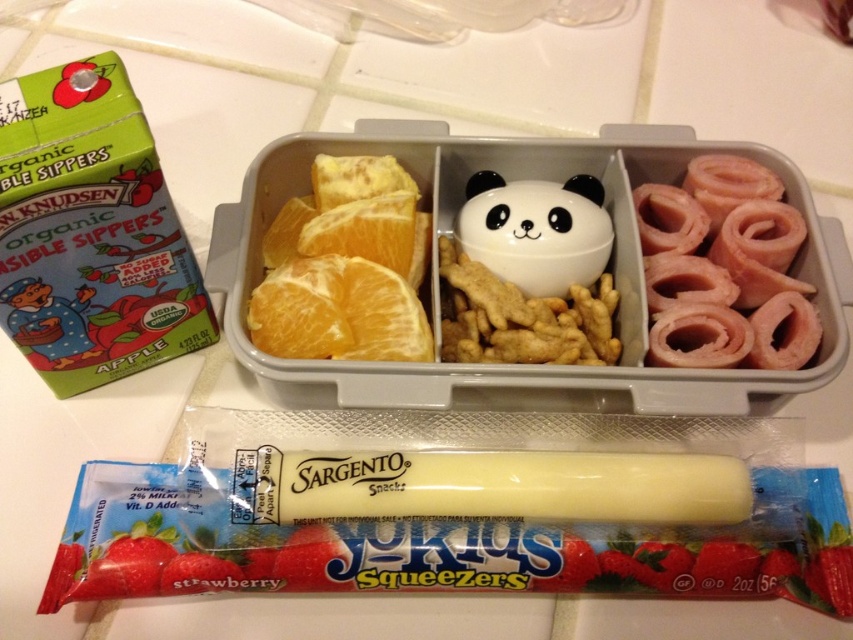
Question: Among these objects, which one is farthest from the camera?

Choices:
 (A) pink/smooth ham rolls at right
 (B) matte green apple at left
 (C) orangejuicy fleshfruit at left
 (D) yellow matte orange at upper left

Answer: (D)

Question: Can you confirm if green matte apple juice box at upper left is positioned below pink/smooth ham rolls at right?

Choices:
 (A) yes
 (B) no

Answer: (B)

Question: In this image, where is white glossy panda-shaped container at center located relative to green matte apple juice box at upper left?

Choices:
 (A) left
 (B) right

Answer: (B)

Question: Which of the following is the farthest from the observer?

Choices:
 (A) (808, 339)
 (B) (310, 236)
 (C) (161, 362)
 (D) (592, 250)

Answer: (C)

Question: Which point is farther to the camera?

Choices:
 (A) matte green apple at left
 (B) yellow matte orange at upper left
 (C) white glossy panda-shaped container at center

Answer: (B)

Question: Observing the image, what is the correct spatial positioning of orangejuicy fleshfruit at left in reference to matte green apple at left?

Choices:
 (A) above
 (B) below

Answer: (A)